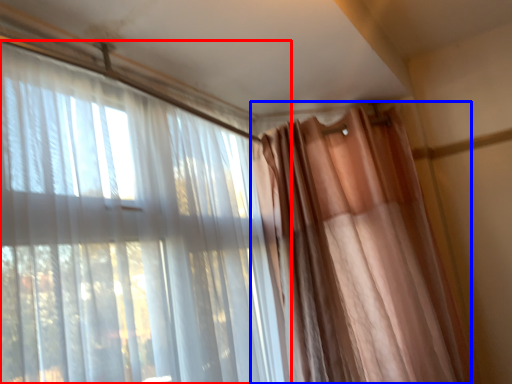
Question: Which of the following is the farthest to the observer, curtain (highlighted by a red box) or curtain (highlighted by a blue box)?

Choices:
 (A) curtain
 (B) curtain

Answer: (B)